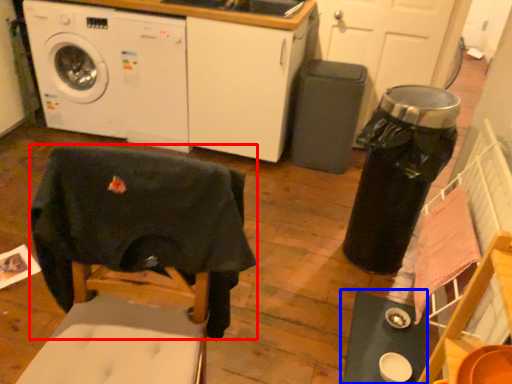
Question: Which point is further to the camera, swivel chair (highlighted by a red box) or table (highlighted by a blue box)?

Choices:
 (A) swivel chair
 (B) table

Answer: (B)